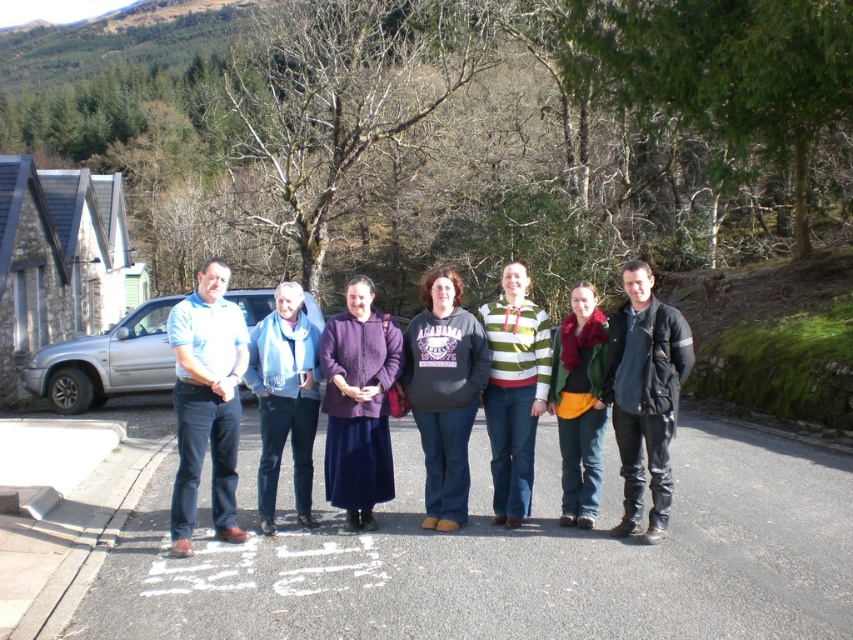
Is blue cotton shirt at left closer to the viewer compared to green woolen sweater at center?

Yes, it is in front of green woolen sweater at center.

The height and width of the screenshot is (640, 853). What are the coordinates of `blue cotton shirt at left` in the screenshot? It's located at [x=206, y=401].

I want to click on blue cotton shirt at left, so click(x=206, y=401).

Who is more forward, (474, 388) or (164, 356)?

Point (474, 388)

Looking at this image, between dark gray sweater at center and silver metallic car at left, which one is positioned higher?

silver metallic car at left is above.

What do you see at coordinates (444, 392) in the screenshot? I see `dark gray sweater at center` at bounding box center [444, 392].

This screenshot has width=853, height=640. Find the location of `dark gray sweater at center`. dark gray sweater at center is located at coordinates (444, 392).

Where is `blue cotton shirt at left`? This screenshot has width=853, height=640. blue cotton shirt at left is located at coordinates (206, 401).

Based on the photo, between blue cotton shirt at left and silver metallic car at left, which one appears on the right side from the viewer's perspective?

From the viewer's perspective, blue cotton shirt at left appears more on the right side.

At what (x,y) coordinates should I click in order to perform the action: click on blue cotton shirt at left. Please return your answer as a coordinate pair (x, y). Looking at the image, I should click on (206, 401).

This screenshot has width=853, height=640. Find the location of `blue cotton shirt at left`. blue cotton shirt at left is located at coordinates (206, 401).